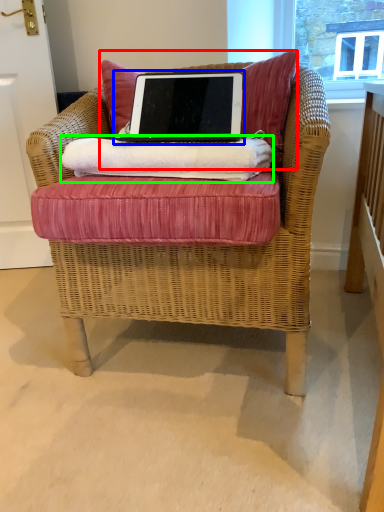
Question: Which object is positioned farthest from pillow (highlighted by a red box)? Select from laptop (highlighted by a blue box) and material (highlighted by a green box).

Choices:
 (A) laptop
 (B) material

Answer: (B)